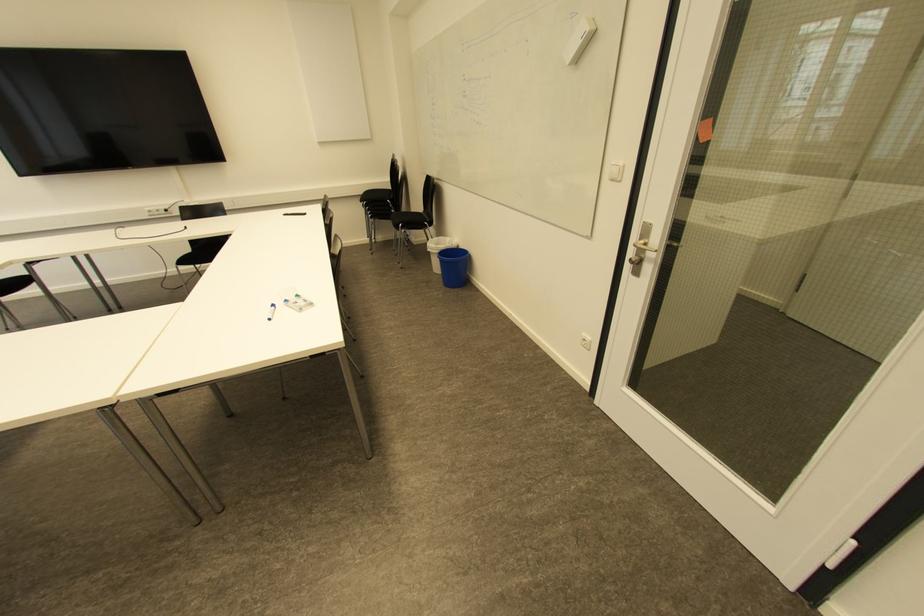
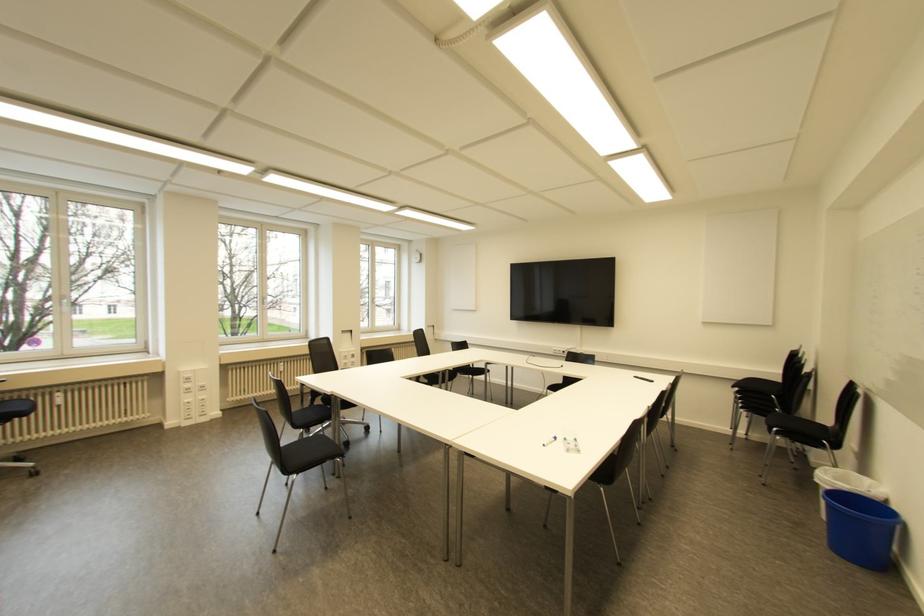
Question: I am providing you with two images of the same scene from different viewpoints. Which of the following objects are not visible in image2?

Choices:
 (A) black chair sitting surface
 (B) white plastic bin
 (C) blue plastic bin
 (D) none of these

Answer: (D)